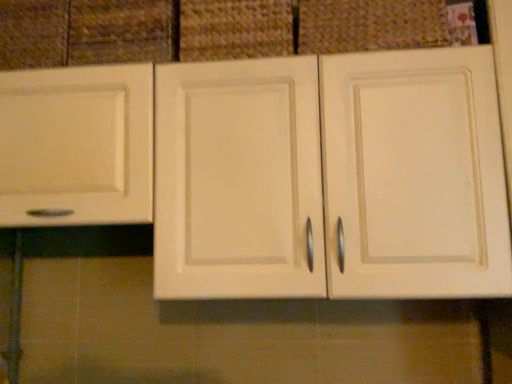
Question: Is matte cream cabinet at center inside or outside of matte fabric basket at upper center, which is the second basket in left-to-right order?

Choices:
 (A) outside
 (B) inside

Answer: (A)

Question: From the image's perspective, is matte cream cabinet at center above or below matte fabric basket at upper center, which is the second basket in left-to-right order?

Choices:
 (A) below
 (B) above

Answer: (A)

Question: Estimate the real-world distances between objects in this image. Which object is closer to the woven fabric basket at upper center, which is counted as the second basket, starting from the right?

Choices:
 (A) matte cream cabinet at center
 (B) matte fabric basket at upper center, which appears as the 1th basket when viewed from the right
 (C) matte white drawer at upper left

Answer: (C)

Question: Considering the real-world distances, which object is closest to the matte cream cabinet at center?

Choices:
 (A) matte fabric basket at upper center, which appears as the 1th basket when viewed from the right
 (B) woven fabric basket at upper center, the first basket when ordered from left to right
 (C) matte white drawer at upper left

Answer: (B)